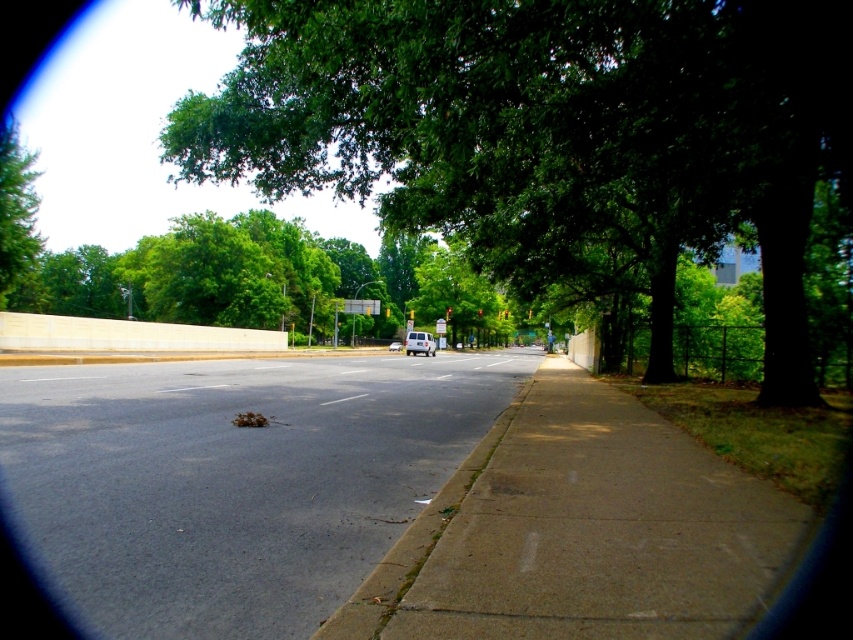
Question: Which of the following is the closest to the observer?

Choices:
 (A) (250, 484)
 (B) (28, 150)
 (C) (428, 337)

Answer: (A)

Question: Where is dark asphalt road at center located in relation to green leafy tree at upper left in the image?

Choices:
 (A) above
 (B) below

Answer: (B)

Question: Which point appears farthest from the camera in this image?

Choices:
 (A) (331, 580)
 (B) (427, 333)

Answer: (B)

Question: Among these objects, which one is farthest from the camera?

Choices:
 (A) dark asphalt road at center
 (B) green leafy tree at upper left

Answer: (B)

Question: Is dark asphalt road at center below green leafy tree at upper left?

Choices:
 (A) no
 (B) yes

Answer: (B)

Question: Does green leafy tree at upper left have a larger size compared to white matte van at center?

Choices:
 (A) yes
 (B) no

Answer: (A)